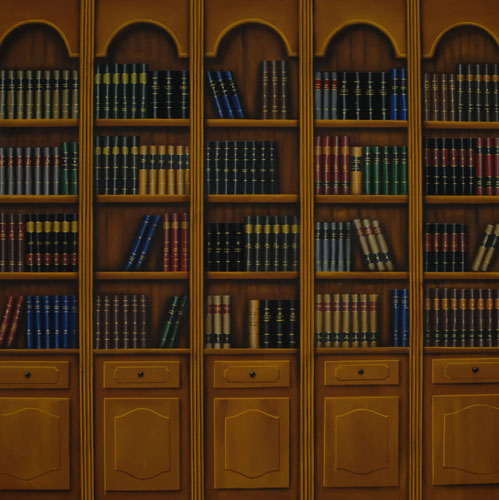
This screenshot has height=500, width=499. In order to click on drawers and cabinets in this screenshot , I will do `click(53, 371)`, `click(54, 450)`, `click(138, 438)`, `click(143, 384)`, `click(261, 379)`, `click(258, 442)`, `click(365, 365)`, `click(363, 425)`, `click(446, 422)`, `click(454, 371)`.